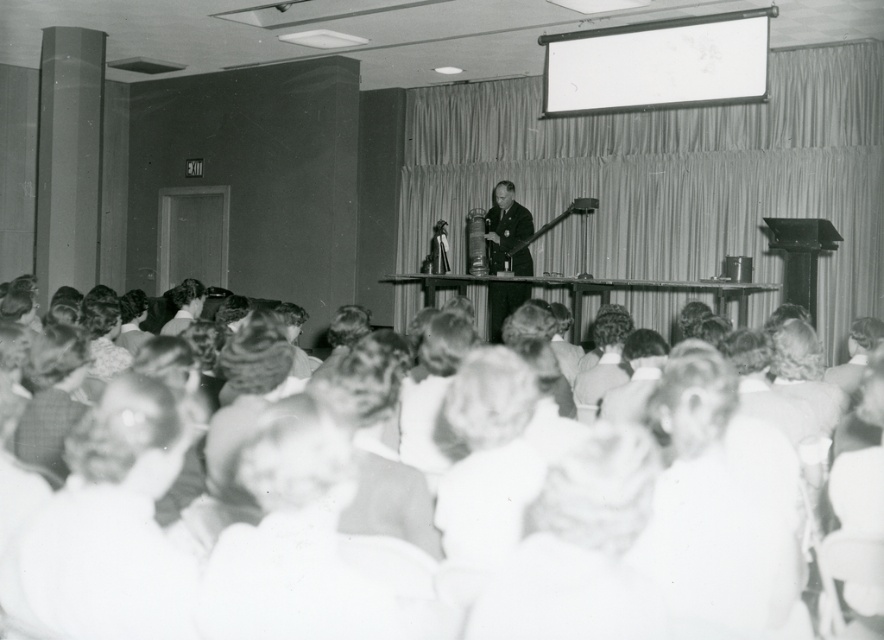
Question: Which object appears closest to the camera in this image?

Choices:
 (A) white cotton shirt at lower left
 (B) dark suit at center

Answer: (A)

Question: Which point is farther from the camera taking this photo?

Choices:
 (A) (113, 636)
 (B) (713, 522)

Answer: (B)

Question: Can you confirm if white cotton shirt at lower left is positioned above white cotton shirt at lower right?

Choices:
 (A) no
 (B) yes

Answer: (B)

Question: Among these points, which one is nearest to the camera?

Choices:
 (A) (692, 588)
 (B) (500, 321)
 (C) (126, 564)

Answer: (C)

Question: Can you confirm if white cotton shirt at lower left is smaller than dark suit at center?

Choices:
 (A) no
 (B) yes

Answer: (B)

Question: Can you confirm if white cotton shirt at lower left is positioned above dark suit at center?

Choices:
 (A) yes
 (B) no

Answer: (B)